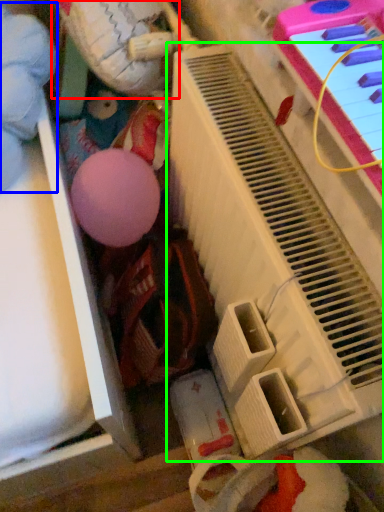
Question: Considering the real-world distances, which object is closest to toy (highlighted by a red box)? toy (highlighted by a blue box) or piano (highlighted by a green box).

Choices:
 (A) toy
 (B) piano

Answer: (A)